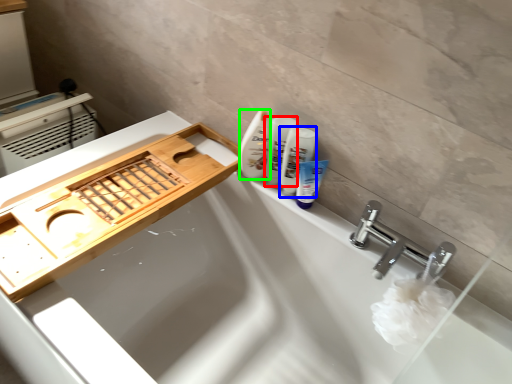
Question: Which object is positioned farthest from toiletry (highlighted by a red box)? Select from mouthwash (highlighted by a blue box) and cleaning product (highlighted by a green box).

Choices:
 (A) mouthwash
 (B) cleaning product

Answer: (A)